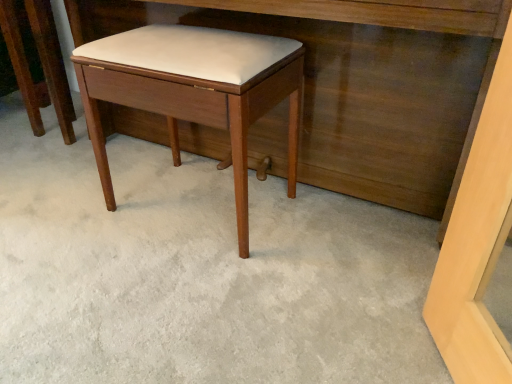
Locate an element on the screen. This screenshot has width=512, height=384. free space to the left of matte wood stool at center is located at coordinates (18, 130).